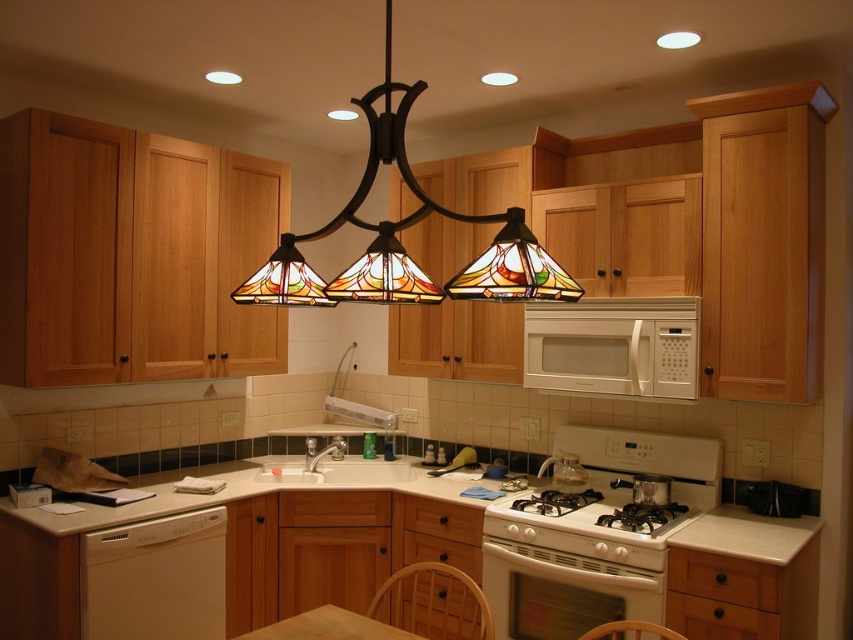
Question: Is white laminate countertop at lower center bigger than white glossy sink at center?

Choices:
 (A) yes
 (B) no

Answer: (B)

Question: Which of the following is the farthest from the observer?

Choices:
 (A) white glossy gas stove at center
 (B) white glossy sink at center

Answer: (B)

Question: Can you confirm if white glossy oven at lower center is thinner than white glossy gas stove at center?

Choices:
 (A) no
 (B) yes

Answer: (B)

Question: Which of the following is the closest to the observer?

Choices:
 (A) (491, 572)
 (B) (563, 493)
 (C) (648, 385)

Answer: (C)

Question: Among these points, which one is farthest from the camera?

Choices:
 (A) (x=691, y=378)
 (B) (x=32, y=604)

Answer: (A)

Question: Is white matte microwave at upper center behind white glossy oven at lower center?

Choices:
 (A) yes
 (B) no

Answer: (A)